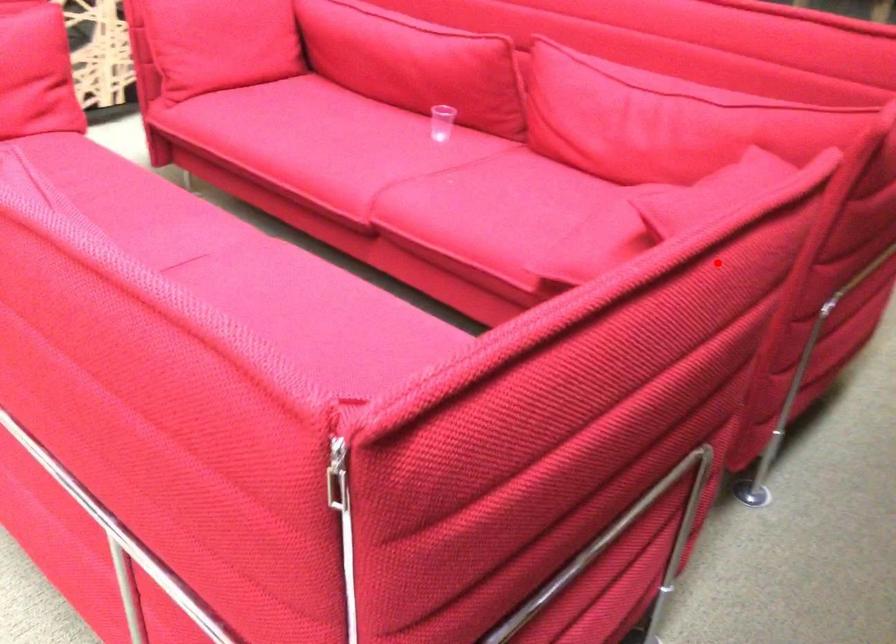
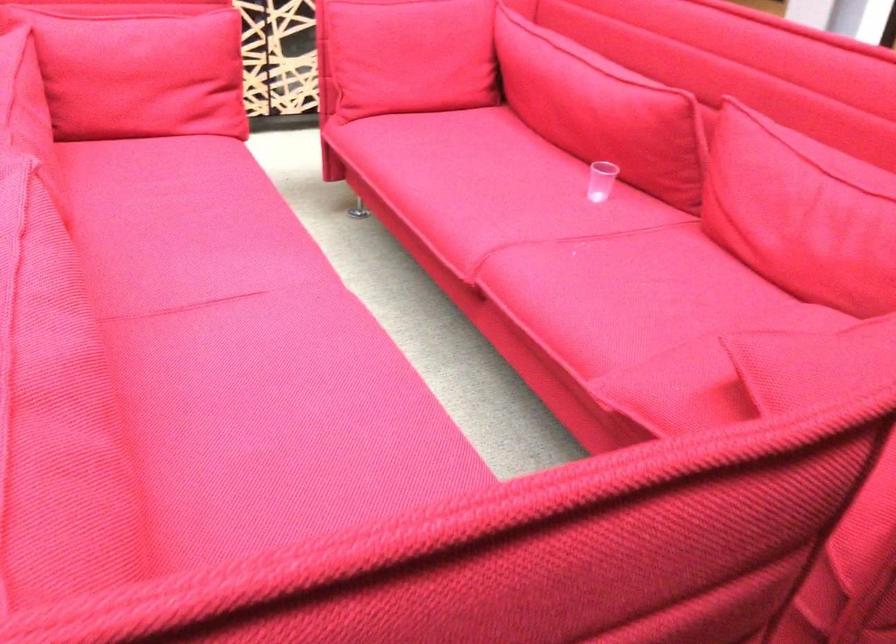
Question: A red point is marked in image1. In image2, is the corresponding 3D point closer to the camera or farther? Reply with the corresponding letter.

Choices:
 (A) The corresponding 3D point is closer.
 (B) The corresponding 3D point is farther.

Answer: (A)